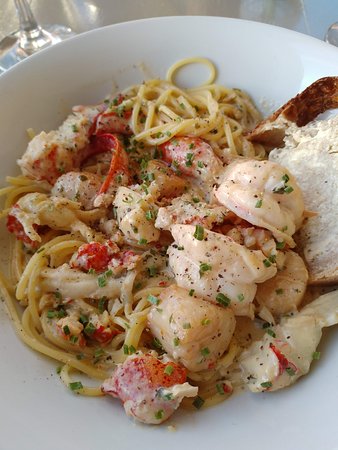
The width and height of the screenshot is (338, 450). In order to click on bottom of wine glasses in this screenshot , I will do `click(19, 46)`, `click(332, 38)`.